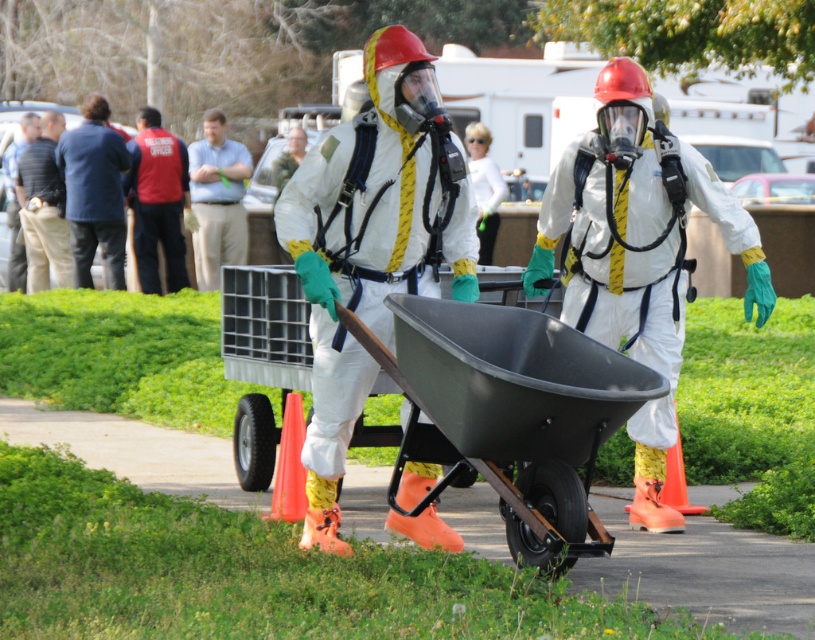
Question: Is matte black wheelbarrow at center behind white matte hazmat suit at center?

Choices:
 (A) yes
 (B) no

Answer: (B)

Question: Which of these objects is positioned farthest from the striped shirt at left?

Choices:
 (A) matte black wheelbarrow at center
 (B) dark blue denim jacket at left

Answer: (A)

Question: Can you confirm if matte black wheelbarrow at center is positioned below white matte hazmat suit at center?

Choices:
 (A) yes
 (B) no

Answer: (A)

Question: Does white matte hazmat suit at center appear on the left side of dark blue denim jacket at left?

Choices:
 (A) yes
 (B) no

Answer: (B)

Question: Which object is farther from the camera taking this photo?

Choices:
 (A) light blue shirt at center
 (B) white matte hazmat suit at center
 (C) matte black wheelbarrow at center

Answer: (A)

Question: Among these objects, which one is farthest from the camera?

Choices:
 (A) matte black wheelbarrow at center
 (B) light blue shirt at center

Answer: (B)